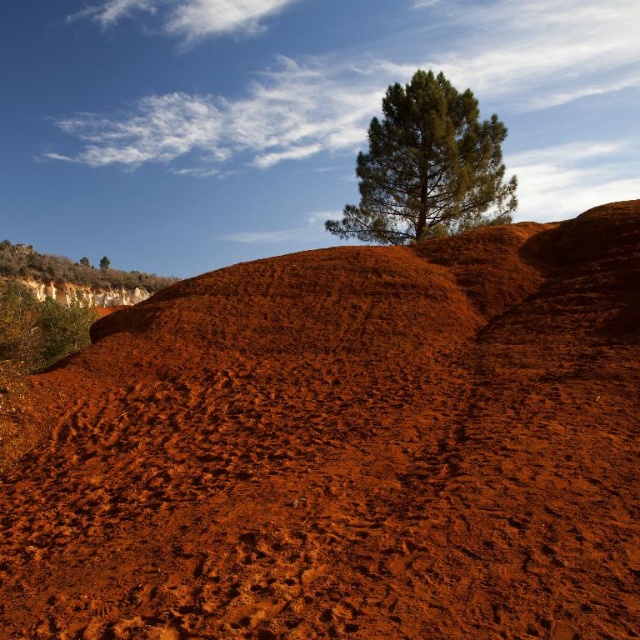
You are an astronaut on Mars and you see the dusty red soil at center and the green textured tree at upper left in the distance. Which object appears closer to you based on their sizes in the image?

The dusty red soil at center appears closer because it is thinner than the green textured tree at upper left, indicating that the tree is farther away and thus smaller in the image.

You are an explorer in this landscape and want to take a photo of both the green leafy tree at upper left and the green textured tree at upper left. However, your camera can only focus on one tree at a time. Which tree should you focus on first to ensure both are in the frame?

You should focus on the green leafy tree at upper left first because it is taller than the green textured tree at upper left, so by centering it, the shorter tree will also be in the frame.

You are an explorer in this landscape and want to climb the tallest tree to get a better view. Which tree should you choose between the green textured tree at upper center and the green textured tree at upper left?

The green textured tree at upper center is taller than the green textured tree at upper left, so you should choose the green textured tree at upper center to climb for a better view.